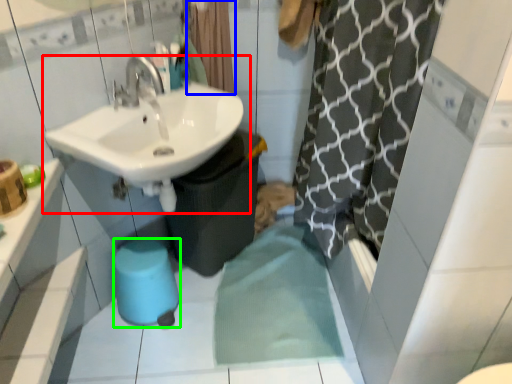
Question: Which object is positioned farthest from sink (highlighted by a red box)? Select from shower curtain (highlighted by a blue box) and bidet (highlighted by a green box).

Choices:
 (A) shower curtain
 (B) bidet

Answer: (B)